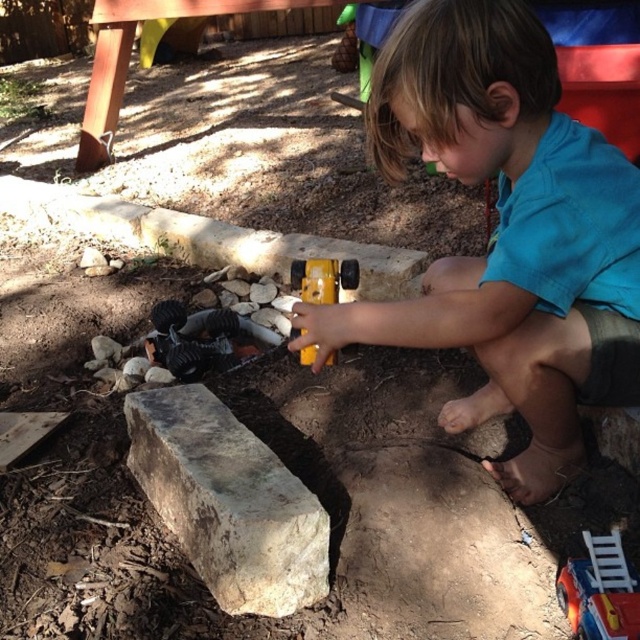
Question: Is blue matte shirt at center to the right of gray rough stone at center from the viewer's perspective?

Choices:
 (A) yes
 (B) no

Answer: (A)

Question: Which of these objects is positioned farthest from the metallic silver toy truck at lower right?

Choices:
 (A) blue matte shirt at center
 (B) gray rough stone at center

Answer: (B)

Question: Can you confirm if blue matte shirt at center is wider than gray rough stone at center?

Choices:
 (A) yes
 (B) no

Answer: (A)

Question: Which object is farther from the camera taking this photo?

Choices:
 (A) gray rough stone at center
 (B) blue matte shirt at center
 (C) metallic silver toy truck at lower right
 (D) yellow plastic hammer at center

Answer: (A)

Question: Which of these objects is positioned closest to the yellow plastic hammer at center?

Choices:
 (A) metallic silver toy truck at lower right
 (B) blue matte shirt at center

Answer: (B)

Question: Is blue matte shirt at center below metallic silver toy truck at lower right?

Choices:
 (A) yes
 (B) no

Answer: (B)